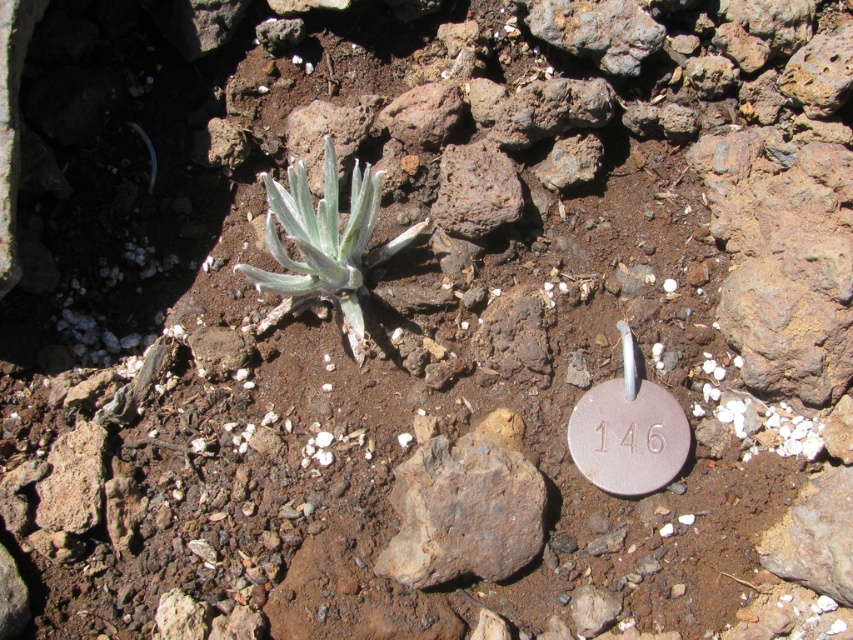
You are a geologist examining the rocky soil patch. You notice the gray rough rock at center. Based on its position, can you determine if it is closer to the edge of the image or the center?

The gray rough rock at center is located at point coordinates that are very close to the center of the image, so it is closer to the center than the edge.

You are standing at point (325, 147) and want to walk to point (421, 504). Which direction should you move in relation to the small plant with long, slender, gray green leaves?

You should move towards the point (421, 504), which is in front of point (325, 147). The small plant with long, slender, gray green leaves is located in the center left of the image, so you would need to move to the right and slightly forward to reach your destination.